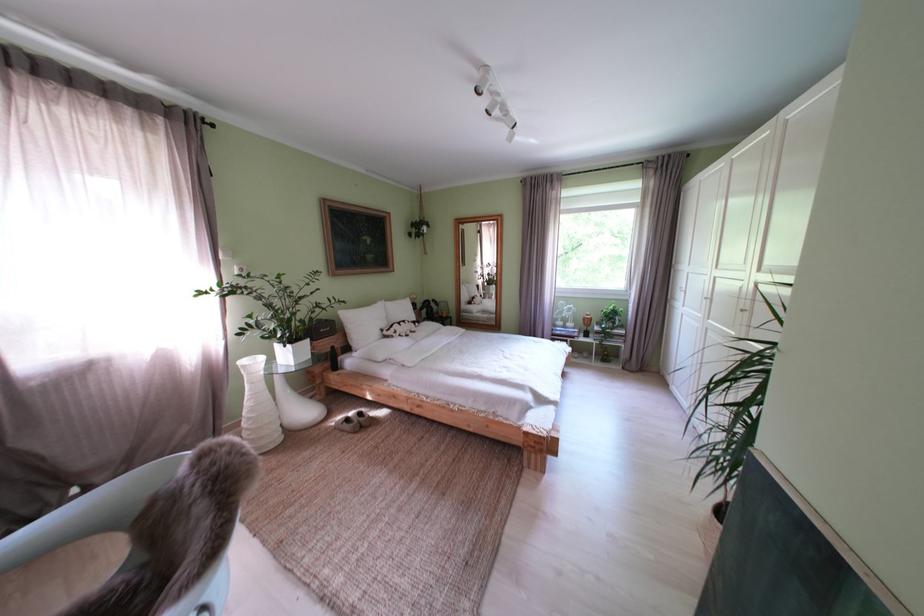
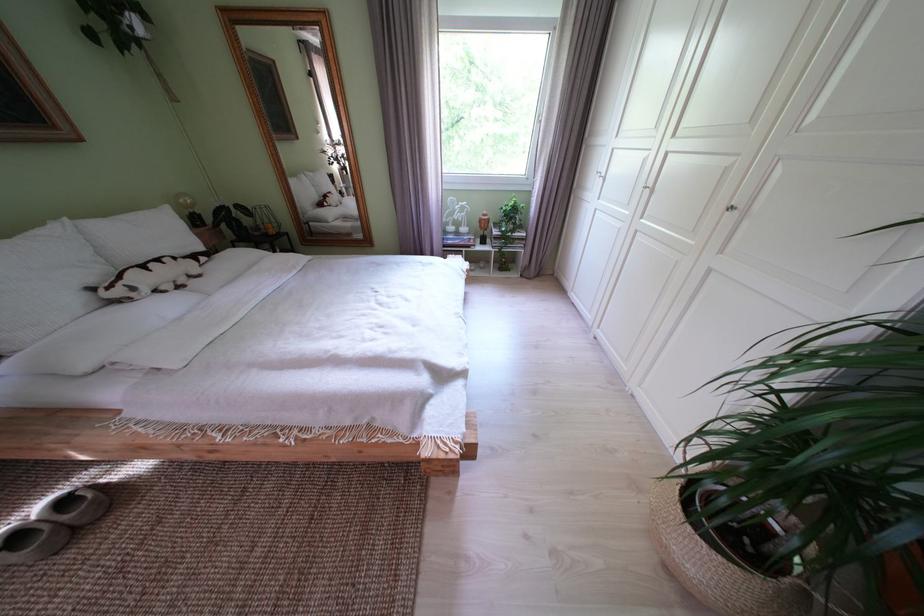
The point at (407, 338) is marked in the first image. Where is the corresponding point in the second image?

(146, 294)